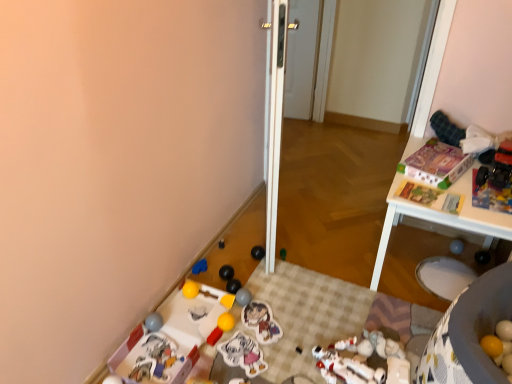
Locate an element on the screen. Image resolution: width=512 pixels, height=384 pixels. free space below plastic toy car at upper right, the 2th toy in the right-to-left sequence (from a real-world perspective) is located at coordinates (495, 181).